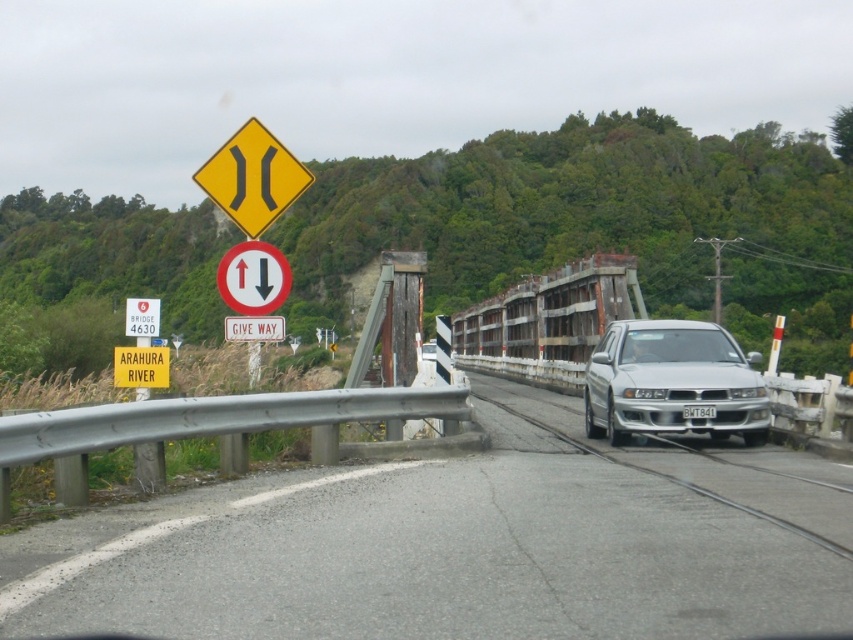
You are standing at the point marked by the coordinates point (252, 177). What object is located at those coordinates?

The yellow diamond at upper center is located at point (252, 177).